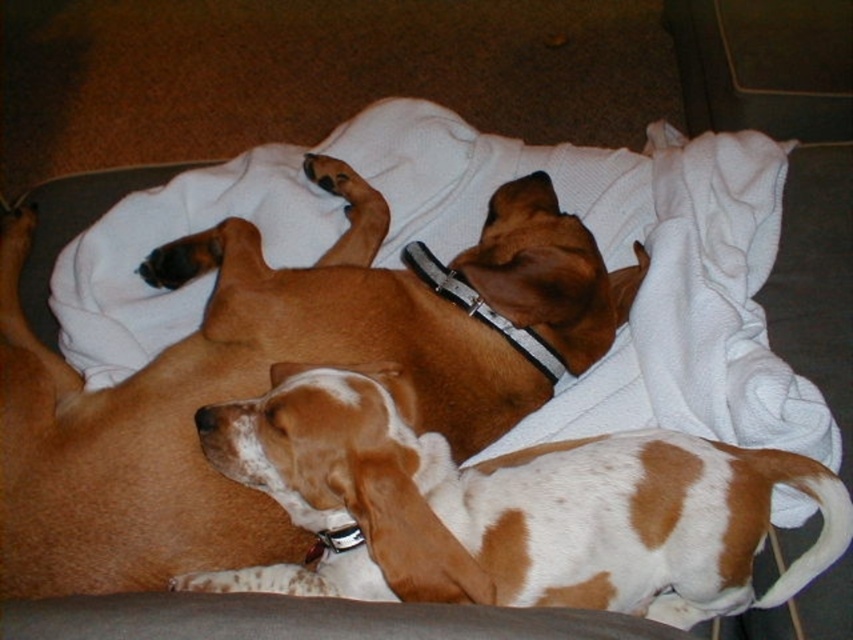
Question: Does brown smooth dog at upper center have a greater width compared to white and brown fur at center?

Choices:
 (A) yes
 (B) no

Answer: (A)

Question: Observing the image, what is the correct spatial positioning of brown smooth dog at upper center in reference to white and brown fur at center?

Choices:
 (A) left
 (B) right

Answer: (A)

Question: Among these objects, which one is farthest from the camera?

Choices:
 (A) white and brown fur at center
 (B) brown smooth dog at upper center

Answer: (B)

Question: Is brown smooth dog at upper center wider than white and brown fur at center?

Choices:
 (A) no
 (B) yes

Answer: (B)

Question: Which object appears closest to the camera in this image?

Choices:
 (A) white and brown fur at center
 (B) brown smooth dog at upper center

Answer: (A)

Question: Among these points, which one is nearest to the camera?

Choices:
 (A) (7, 483)
 (B) (346, 384)

Answer: (B)